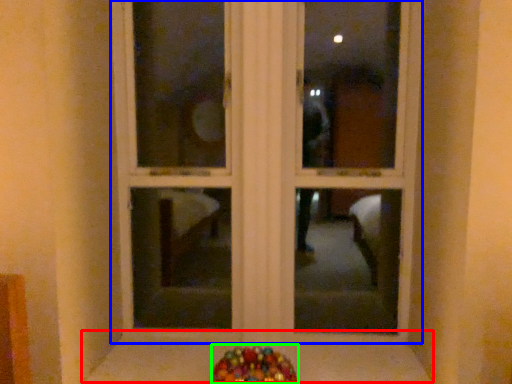
Question: Based on their relative distances, which object is farther from window sill (highlighted by a red box)? Choose from window frame (highlighted by a blue box) and candy (highlighted by a green box).

Choices:
 (A) window frame
 (B) candy

Answer: (A)